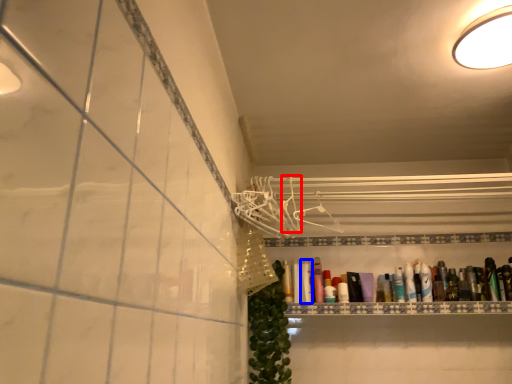
Question: Which object is further to the camera taking this photo, hanger (highlighted by a red box) or toiletry (highlighted by a blue box)?

Choices:
 (A) hanger
 (B) toiletry

Answer: (B)